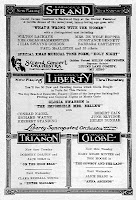
I want to click on certificate, so click(82, 110).